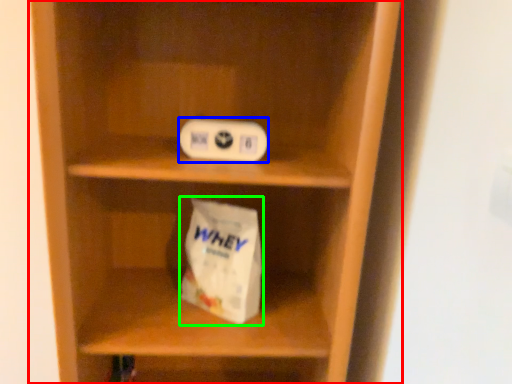
Question: Based on their relative distances, which object is nearer to shelf (highlighted by a red box)? Choose from ipod (highlighted by a blue box) and paper bag (highlighted by a green box).

Choices:
 (A) ipod
 (B) paper bag

Answer: (B)